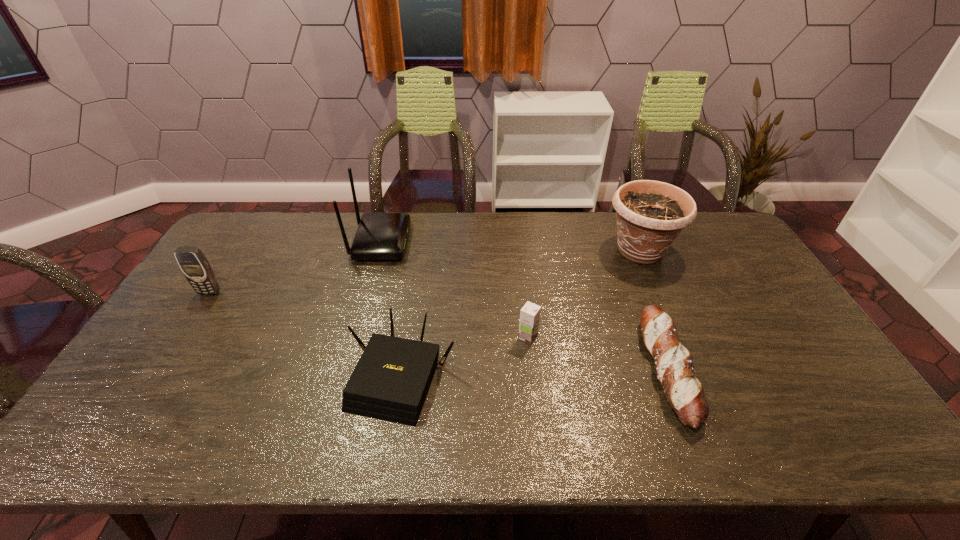
The width and height of the screenshot is (960, 540). What are the coordinates of `the taller router` in the screenshot? It's located at (380, 236).

The height and width of the screenshot is (540, 960). What are the coordinates of `flowerpot` in the screenshot? It's located at (650, 214).

This screenshot has width=960, height=540. Identify the location of the third tallest object. (191, 260).

Identify the location of the leftmost object. The image size is (960, 540). (191, 260).

What are the coordinates of `the third object from right to left` in the screenshot? It's located at (530, 313).

At what (x,y) coordinates should I click in order to perform the action: click on the shorter router. Please return your answer as a coordinate pair (x, y). Looking at the image, I should click on (390, 382).

Where is `the shortest object`? the shortest object is located at coordinates (673, 362).

I want to click on free space located 0.400m on the front-facing side of the farther router, so click(x=521, y=241).

What are the coordinates of `vacant region located on the right of the flowerpot` in the screenshot? It's located at (709, 251).

Where is `vacant space located 0.090m on the front face of the third tallest object`? The width and height of the screenshot is (960, 540). vacant space located 0.090m on the front face of the third tallest object is located at coordinates (193, 318).